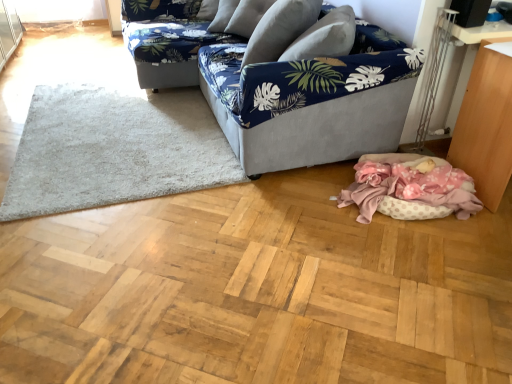
This screenshot has width=512, height=384. I want to click on vacant space underneath white shaggy rug at lower left (from a real-world perspective), so click(x=126, y=129).